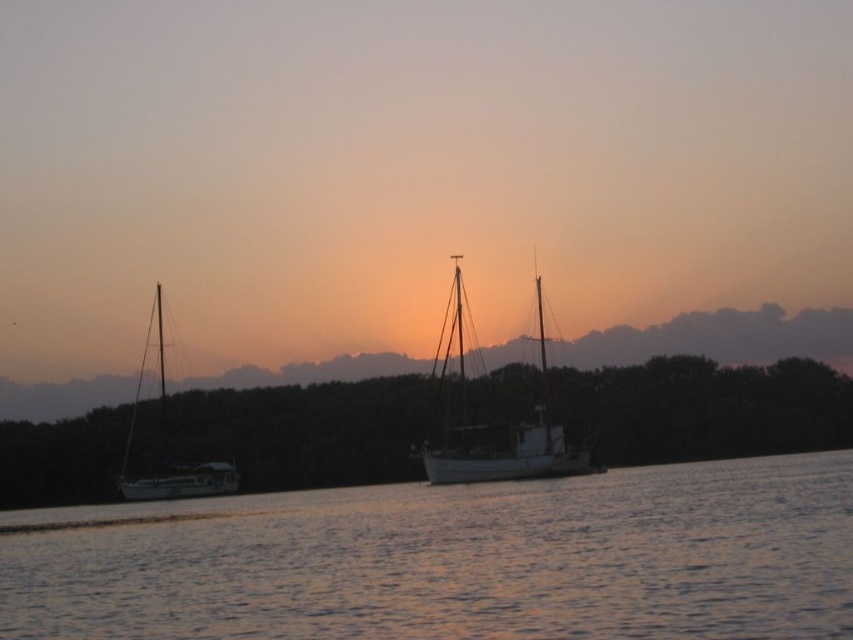
You are an artist planning to paint this sunset scene. You want to ensure the smooth water at center and the white matte sailboat at left are proportionally accurate. Which object should you paint first to maintain the correct size relationship?

You should paint the white matte sailboat at left first since the smooth water at center occupies less space, meaning the sailboat is larger and should be placed first to ensure proper scaling.